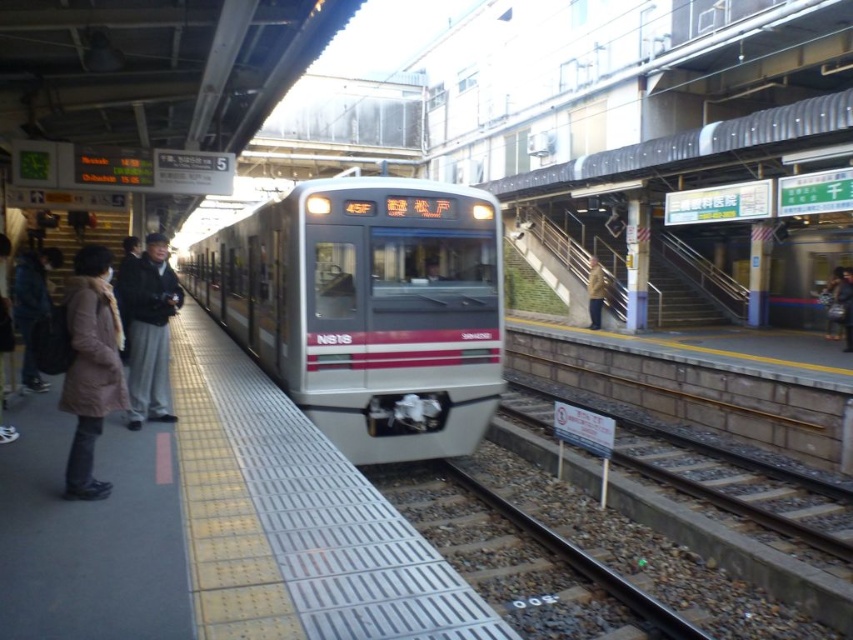
You are a photographer standing on the platform and want to capture both the silver metallic train at center and the dark gray fabric jacket at left in a single photo. Which object should you frame first to ensure both are fully visible in the photo?

You should frame the silver metallic train at center first because it is wider than the dark gray fabric jacket at left, so positioning it first ensures there is enough space for both in the photo.

You are a passenger waiting on the platform. You notice a silver metallic train at center and a brown leather jacket at center. Which object is positioned higher in the scene?

The silver metallic train at center is positioned higher than the brown leather jacket at center.

You are a photographer standing on the platform at the train station. You want to take a photo of the silver metallic train at center and the brown leather jacket at center. Which object is wider in the image?

The silver metallic train at center is wider than the brown leather jacket at center.